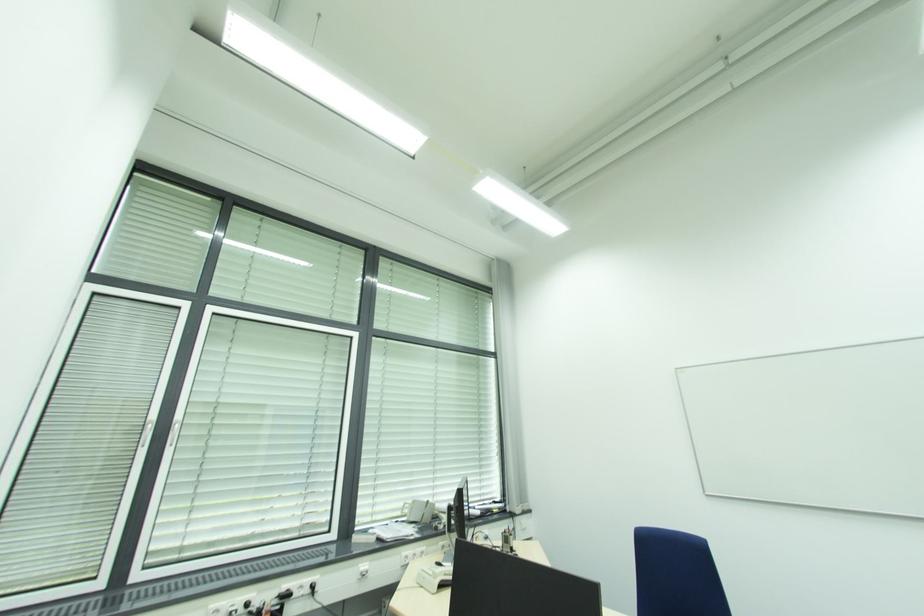
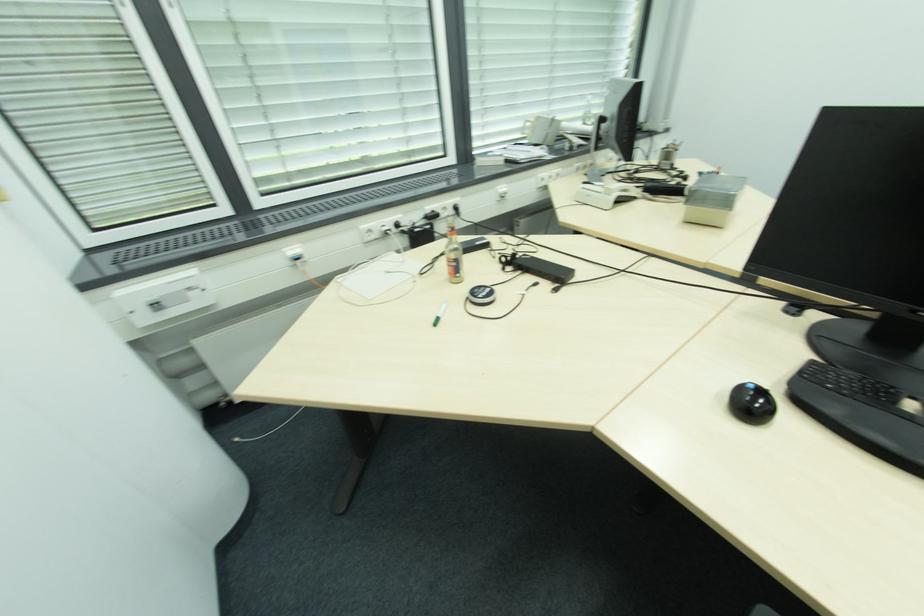
Find the pixel in the second image that matches (x=438, y=576) in the first image.

(612, 193)